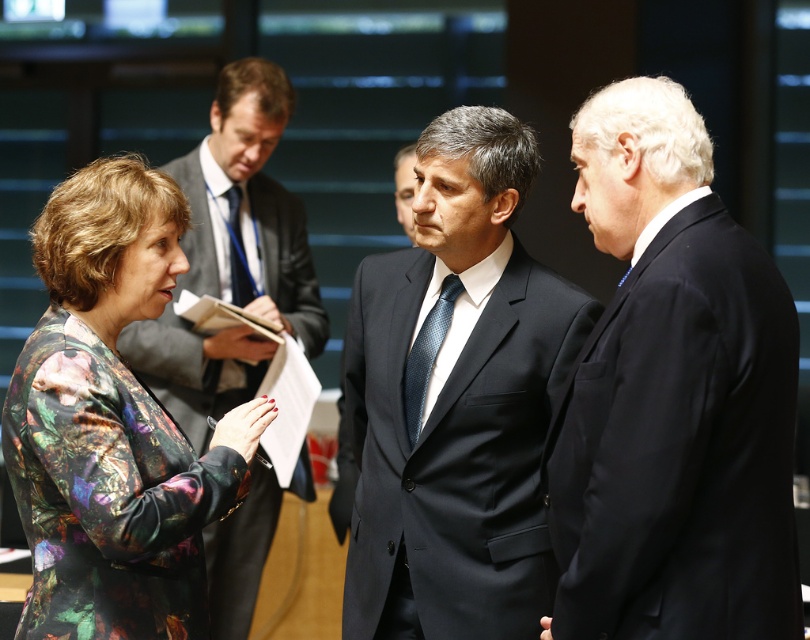
Locate an element on the screen. The width and height of the screenshot is (810, 640). matte black suit at center is located at coordinates (455, 397).

Who is more distant from viewer, [352,554] or [96,280]?

Positioned behind is point [352,554].

Image resolution: width=810 pixels, height=640 pixels. Find the location of `matte black suit at center`. matte black suit at center is located at coordinates (455, 397).

Which is in front, point (565, 476) or point (165, 611)?

Positioned in front is point (565, 476).

Where is `black suit at right`? black suit at right is located at coordinates (672, 397).

Does point (640, 600) come closer to viewer compared to point (250, 339)?

Yes, point (640, 600) is closer to viewer.

Is black suit at right further to camera compared to blue silk tie at center?

No.

Is point (678, 412) more distant than point (233, 266)?

No, it is in front of (233, 266).

Identify the location of black suit at right. (672, 397).